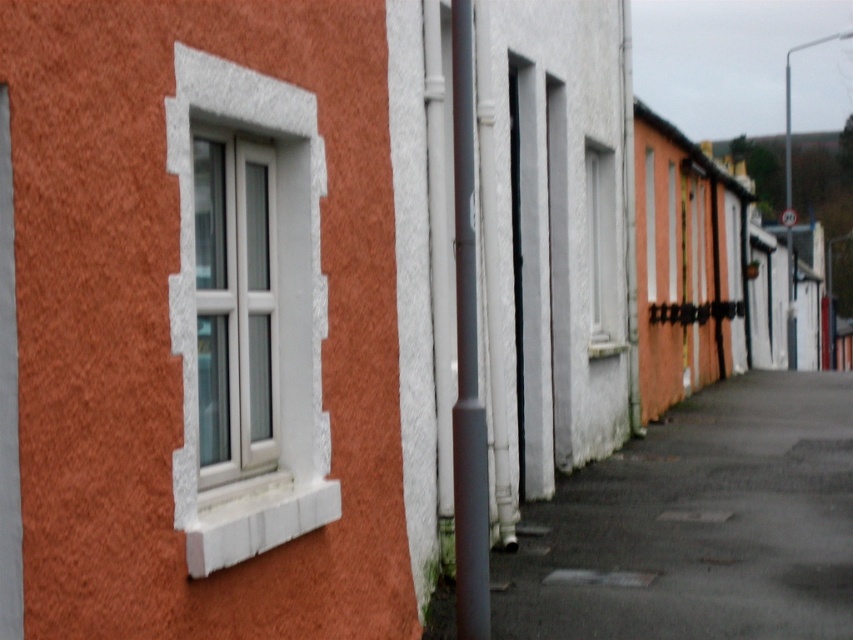
Question: Which of the following is the farthest from the observer?

Choices:
 (A) (254, 275)
 (B) (599, 337)
 (C) (828, 632)

Answer: (B)

Question: Is dark asphalt at lower center above white textured window at center?

Choices:
 (A) no
 (B) yes

Answer: (A)

Question: Is the position of white stone window at left more distant than that of white textured window at center?

Choices:
 (A) yes
 (B) no

Answer: (B)

Question: Based on their relative distances, which object is farther from the white plastic window at center?

Choices:
 (A) white plastic pole at center
 (B) white textured window at center
 (C) white stone window at left

Answer: (B)

Question: Can you confirm if white stone window at left is positioned to the left of white textured window at center?

Choices:
 (A) no
 (B) yes

Answer: (B)

Question: Which is nearer to the white plastic pole at center?

Choices:
 (A) white stone window at left
 (B) white textured window at center
 (C) dark asphalt at lower center
 (D) white plastic window at center

Answer: (A)